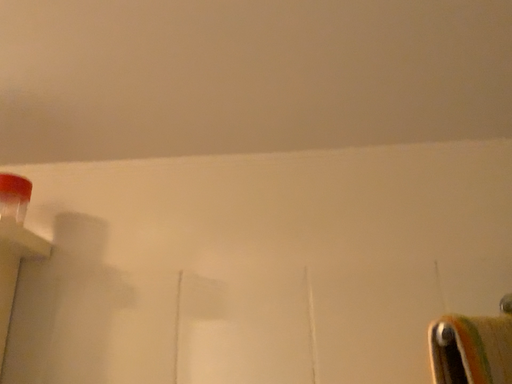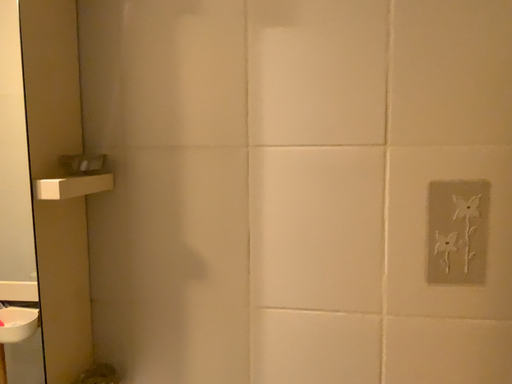
Question: How did the camera likely rotate when shooting the video?

Choices:
 (A) rotated downward
 (B) rotated upward

Answer: (A)